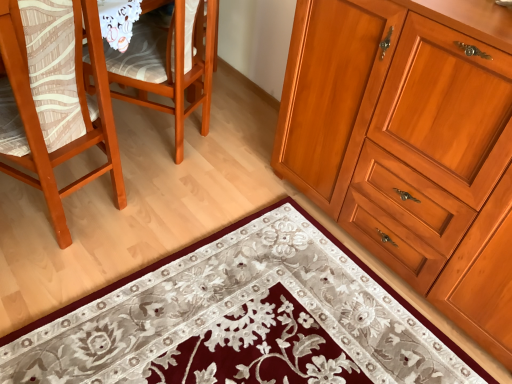
Identify the location of vacant area that lies between wooden cabinet at right and wooden chair at left, the 1th chair viewed from the right. The image size is (512, 384). (264, 212).